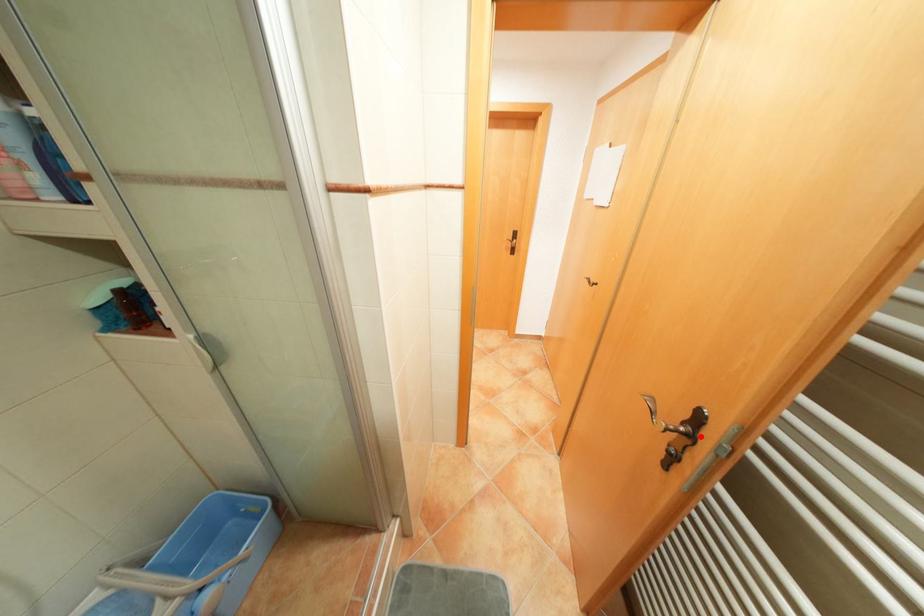
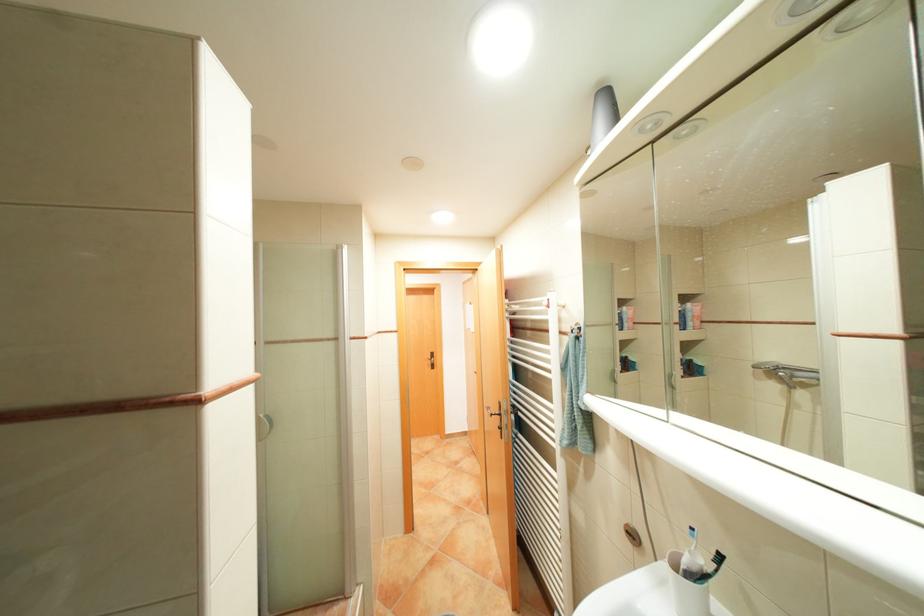
Locate, in the second image, the point that corresponds to the highlighted location in the first image.

(509, 413)